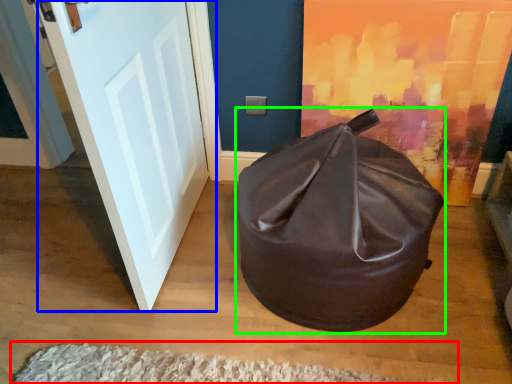
Question: Estimate the real-world distances between objects in this image. Which object is farther from doormat (highlighted by a red box), door (highlighted by a blue box) or bean bag chair (highlighted by a green box)?

Choices:
 (A) door
 (B) bean bag chair

Answer: (A)